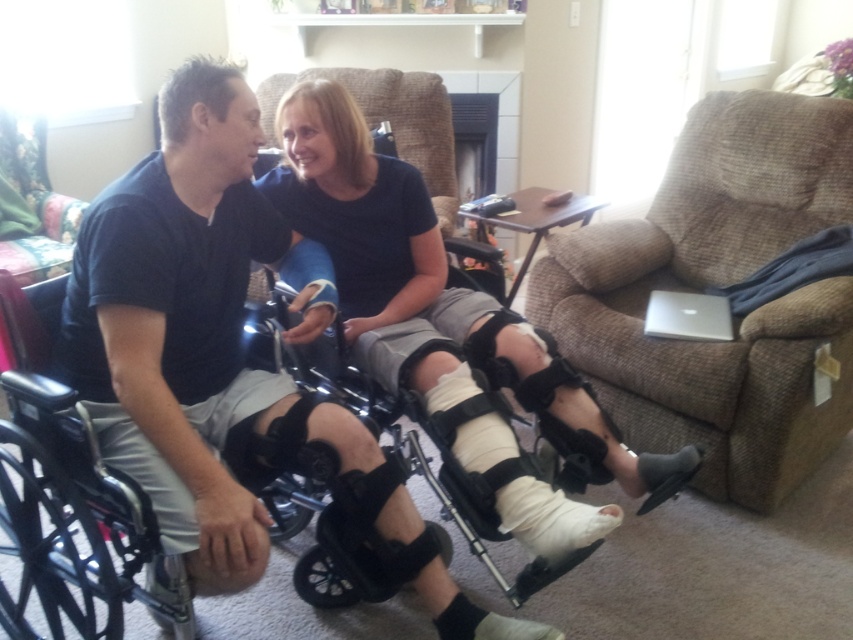
Which is behind, point (583, 428) or point (270, 310)?

The point (270, 310) is behind.

Does point (399, 324) come closer to viewer compared to point (270, 316)?

No, it is behind (270, 316).

Is point (375, 166) positioned behind point (32, 420)?

Yes.

At what (x,y) coordinates should I click in order to perform the action: click on white bandaged leg at center. Please return your answer as a coordinate pair (x, y). The image size is (853, 640). Looking at the image, I should click on (432, 294).

Which is behind, point (267, 330) or point (480, 433)?

The point (267, 330) is more distant.

Is black plastic wheelchair at left wider than white matte plaster bandage at lower center?

Yes, black plastic wheelchair at left is wider than white matte plaster bandage at lower center.

Is point (21, 307) positioned in front of point (515, 500)?

No, it is not.

The height and width of the screenshot is (640, 853). Find the location of `black plastic wheelchair at left`. black plastic wheelchair at left is located at coordinates (380, 432).

Who is positioned more to the right, brown fabric armchair at right or black plastic wheelchair at left?

brown fabric armchair at right is more to the right.

Is point (788, 122) positioned in front of point (259, 324)?

No, it is not.

Identify the location of brown fabric armchair at right. The image size is (853, 640). (717, 285).